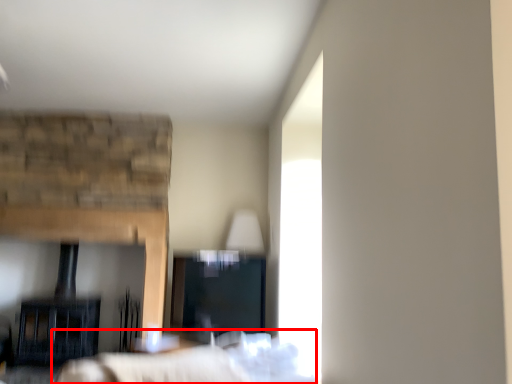
Question: Where is bed (annotated by the red box) located in relation to fireplace in the image?

Choices:
 (A) left
 (B) right

Answer: (B)